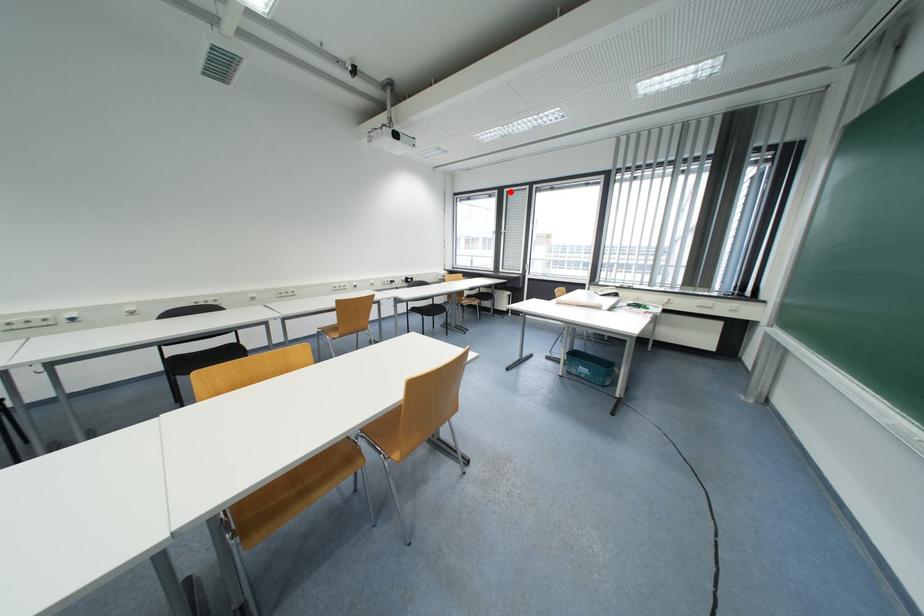
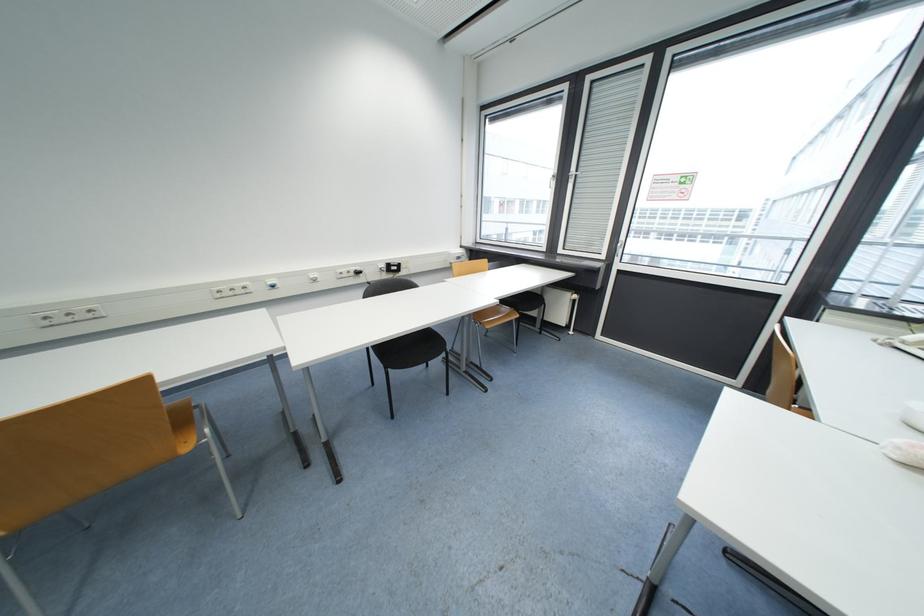
Question: I am providing you with two images of the same scene from different viewpoints. A red point is shown in image1. For the corresponding object point in image2, is it positioned nearer or farther from the camera?

Choices:
 (A) Nearer
 (B) Farther

Answer: (B)